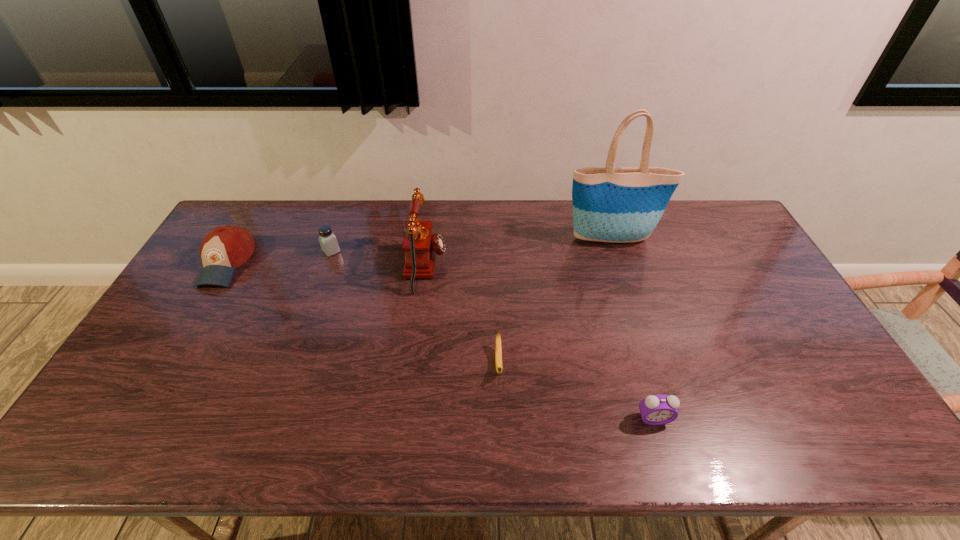
This screenshot has height=540, width=960. What are the coordinates of `vacant space located on the front-facing side of the leftmost object` in the screenshot? It's located at (181, 339).

Locate an element on the screen. Image resolution: width=960 pixels, height=540 pixels. free space located 0.320m on the front of the second object from left to right is located at coordinates (301, 333).

What are the coordinates of `vacant area situated on the face of the alarm clock` in the screenshot? It's located at (661, 446).

Locate an element on the screen. The width and height of the screenshot is (960, 540). vacant region located at the stem of the shortest object is located at coordinates (500, 401).

Identify the location of tote bag present at the far edge. This screenshot has height=540, width=960. coord(611,204).

Where is `telephone that is at the far edge`? The image size is (960, 540). telephone that is at the far edge is located at coordinates 420,245.

The width and height of the screenshot is (960, 540). I want to click on baseball cap that is at the far edge, so click(225, 248).

This screenshot has height=540, width=960. What are the coordinates of `object located at the near edge` in the screenshot? It's located at (660, 409).

The image size is (960, 540). In order to click on object located at the left edge in this screenshot , I will do `click(225, 248)`.

Locate an element on the screen. Image resolution: width=960 pixels, height=540 pixels. object at the far left corner is located at coordinates point(225,248).